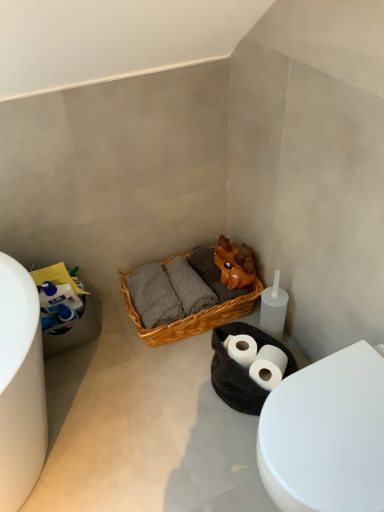
Question: From a real-world perspective, is woven wood picnic basket at center positioned under white glossy toilet at lower right based on gravity?

Choices:
 (A) no
 (B) yes

Answer: (B)

Question: Does woven wood picnic basket at center have a smaller size compared to white glossy toilet at lower right?

Choices:
 (A) no
 (B) yes

Answer: (B)

Question: Is woven wood picnic basket at center closer to camera compared to white glossy toilet at lower right?

Choices:
 (A) no
 (B) yes

Answer: (A)

Question: Is woven wood picnic basket at center oriented towards white glossy toilet at lower right?

Choices:
 (A) yes
 (B) no

Answer: (B)

Question: Is woven wood picnic basket at center looking in the opposite direction of white glossy toilet at lower right?

Choices:
 (A) yes
 (B) no

Answer: (B)

Question: Is woven wood picnic basket at center next to white glossy toilet at lower right and touching it?

Choices:
 (A) no
 (B) yes

Answer: (A)

Question: From a real-world perspective, is white glossy toilet at lower right physically above white matte toilet paper at lower left?

Choices:
 (A) yes
 (B) no

Answer: (B)

Question: Considering the relative sizes of white glossy toilet at lower right and white matte toilet paper at lower left in the image provided, is white glossy toilet at lower right wider than white matte toilet paper at lower left?

Choices:
 (A) yes
 (B) no

Answer: (A)

Question: Is white glossy toilet at lower right far away from white matte toilet paper at lower left?

Choices:
 (A) yes
 (B) no

Answer: (B)

Question: From the image's perspective, is white glossy toilet at lower right below white matte toilet paper at lower left?

Choices:
 (A) no
 (B) yes

Answer: (B)

Question: From the image's perspective, is white glossy toilet at lower right located above white matte toilet paper at lower left?

Choices:
 (A) yes
 (B) no

Answer: (B)

Question: Can you confirm if white glossy toilet at lower right is smaller than white matte toilet paper at lower left?

Choices:
 (A) no
 (B) yes

Answer: (A)

Question: Is white matte toilet paper at lower left inside woven wood picnic basket at center?

Choices:
 (A) yes
 (B) no

Answer: (B)